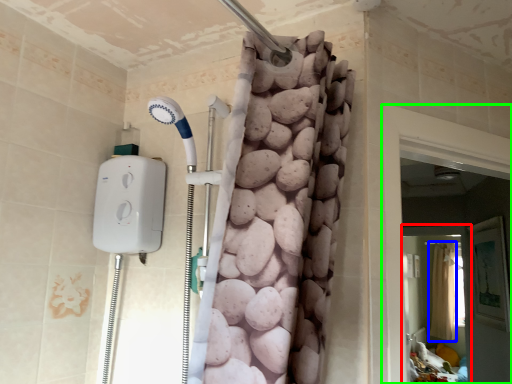
Question: Based on their relative distances, which object is farther from screen door (highlighted by a red box)? Choose from shower curtain (highlighted by a blue box) and screen door (highlighted by a green box).

Choices:
 (A) shower curtain
 (B) screen door

Answer: (B)